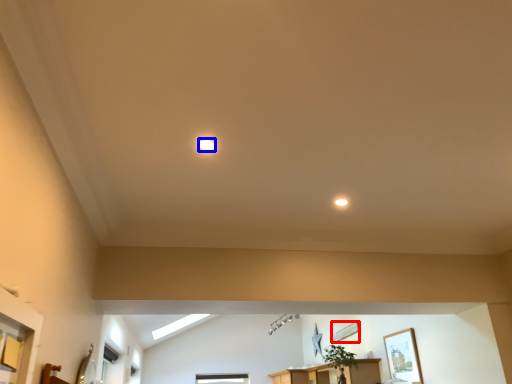
Question: Which object is closer to the camera taking this photo, picture frame (highlighted by a red box) or lighting (highlighted by a blue box)?

Choices:
 (A) picture frame
 (B) lighting

Answer: (B)